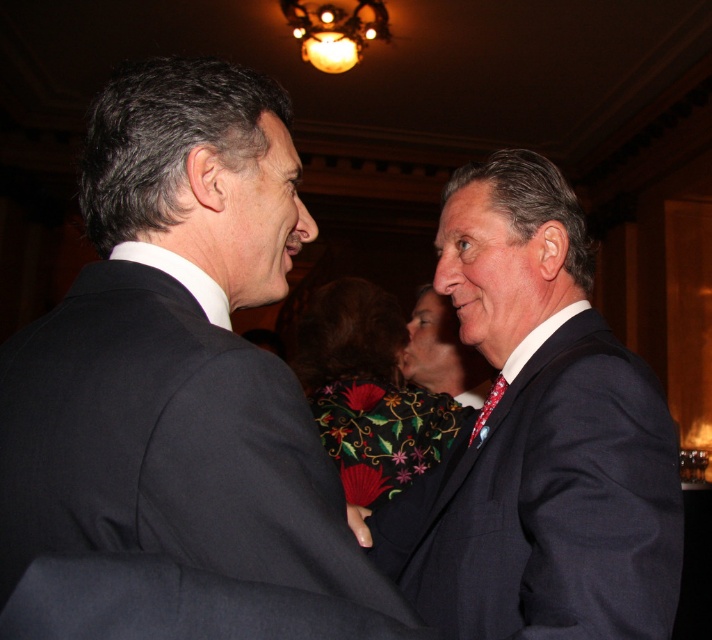
Question: Estimate the real-world distances between objects in this image. Which object is closer to the dark blue suit at right?

Choices:
 (A) matte black suit at center
 (B) embroidered silk vest at center
 (C) patterned silk tie at right
 (D) black matte suit at center

Answer: (C)

Question: Which is nearer to the embroidered silk vest at center?

Choices:
 (A) black matte suit at center
 (B) matte black suit at center

Answer: (B)

Question: Does matte black suit at center come in front of patterned silk tie at right?

Choices:
 (A) no
 (B) yes

Answer: (A)

Question: Is matte black suit at center above patterned silk tie at right?

Choices:
 (A) yes
 (B) no

Answer: (A)

Question: Does matte black suit at center come in front of patterned silk tie at right?

Choices:
 (A) no
 (B) yes

Answer: (A)

Question: Which point is closer to the camera?

Choices:
 (A) embroidered silk vest at center
 (B) dark blue suit at right
 (C) matte black suit at center

Answer: (B)